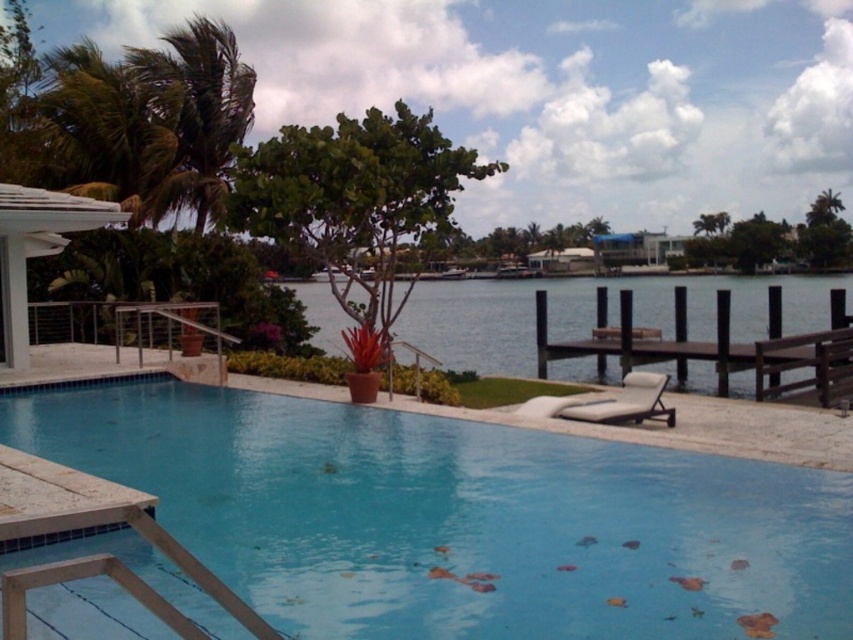
You are planning to place a new potted plant between the brown wooden dock at lower right and the white fabric daybed at lower right. Based on their positions, which object should the plant be closer to?

The white fabric daybed at lower right is behind the brown wooden dock at lower right, so the plant should be placed closer to the brown wooden dock at lower right to ensure it is between them.

You are planning to install a new bench in the waterfront scene. The bench must be placed between the green leafy palm tree at upper left and the brown wooden dock at lower right. Considering their sizes, which object should the bench be closer to to ensure it doesn

The bench should be placed closer to the brown wooden dock at lower right because the green leafy palm tree at upper left is larger in size, so the dock is smaller and requires less space around it.

You are standing at the edge of the pool and want to walk to the blue wooden dock at center. Which direction should you head to avoid the white fabric daybed at lower right?

You should head to the left to reach the blue wooden dock at center without going near the white fabric daybed at lower right, since the blue wooden dock at center is to the right of the daybed.